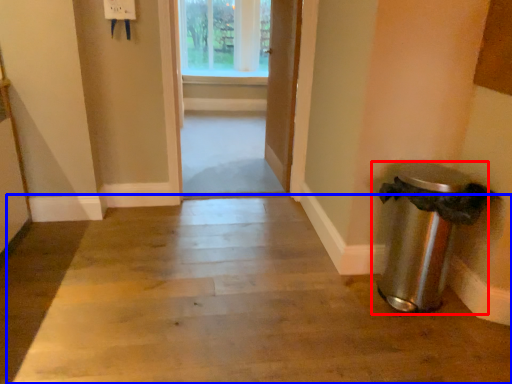
Question: Which point is closer to the camera, waste container (highlighted by a red box) or path (highlighted by a blue box)?

Choices:
 (A) waste container
 (B) path

Answer: (B)